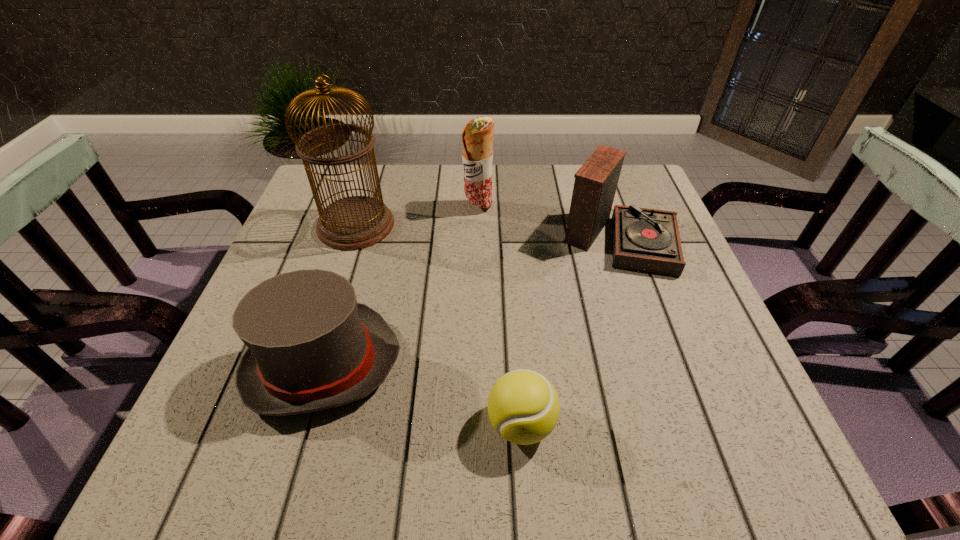
Identify the location of birdcage that is at the far edge. (356, 222).

The height and width of the screenshot is (540, 960). I want to click on burrito at the far edge, so click(477, 136).

Identify the location of phonograph record that is at the far edge. (647, 240).

In order to click on dress hat that is positioned at the near edge in this screenshot , I will do `click(311, 346)`.

Identify the location of tennis ball positioned at the near edge. (523, 406).

You are a GUI agent. You are given a task and a screenshot of the screen. Output one action in this format:
    pyautogui.click(x=<x>, y=<y>)
    Task: Click on the birdcage at the left edge
    This screenshot has width=960, height=540.
    Given the screenshot: What is the action you would take?
    pyautogui.click(x=356, y=222)

Identify the location of dress hat present at the left edge. (311, 346).

In order to click on object that is at the right edge in this screenshot , I will do `click(647, 240)`.

At what (x,y) coordinates should I click in order to perform the action: click on object that is at the far left corner. Please return your answer as a coordinate pair (x, y). This screenshot has width=960, height=540. Looking at the image, I should click on (356, 222).

The image size is (960, 540). Find the location of `object that is at the near left corner`. object that is at the near left corner is located at coordinates (311, 346).